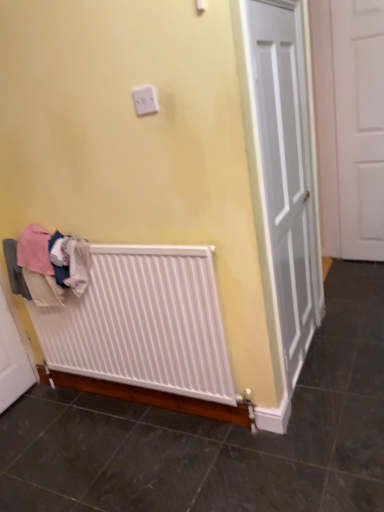
Question: Considering the positions of white plastic outlet at upper center and white matte radiator at lower left in the image, is white plastic outlet at upper center wider or thinner than white matte radiator at lower left?

Choices:
 (A) thin
 (B) wide

Answer: (A)

Question: From the image's perspective, is white plastic outlet at upper center positioned above or below white matte radiator at lower left?

Choices:
 (A) above
 (B) below

Answer: (A)

Question: Which of these objects is positioned closest to the white cotton clothes at lower left?

Choices:
 (A) white matte door at right
 (B) white matte radiator at lower left
 (C) white plastic outlet at upper center

Answer: (B)

Question: Estimate the real-world distances between objects in this image. Which object is farther from the white cotton clothes at lower left?

Choices:
 (A) white matte door at right
 (B) white matte radiator at lower left
 (C) white plastic outlet at upper center

Answer: (A)